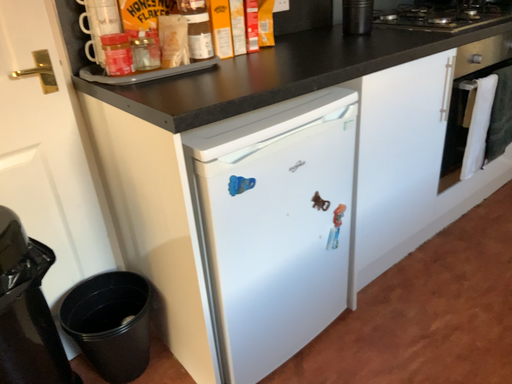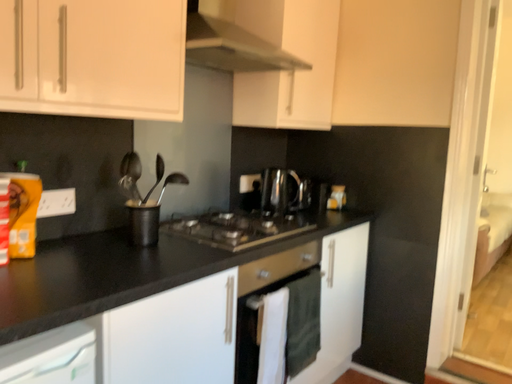
Question: Which way did the camera rotate in the video?

Choices:
 (A) rotated downward
 (B) rotated upward

Answer: (B)